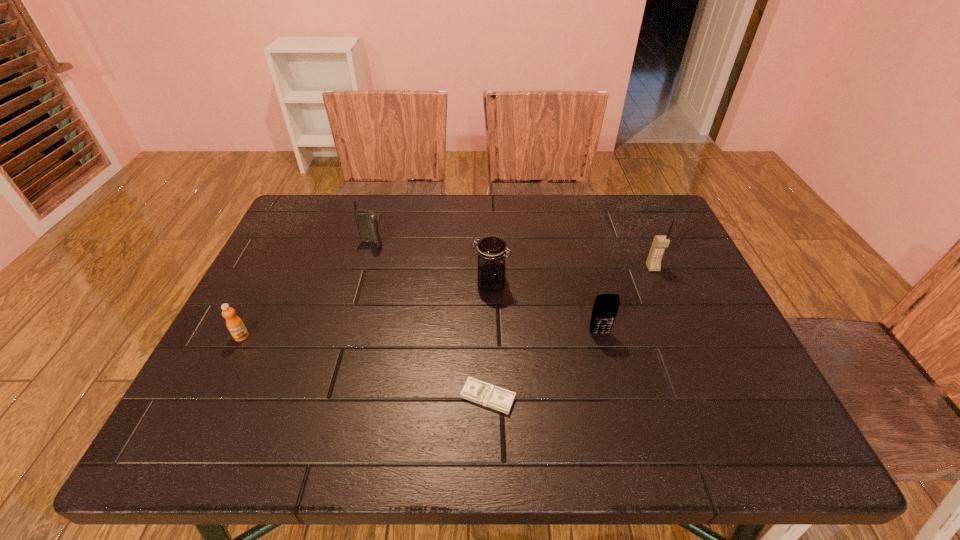
Identify which cellular telephone is the second nearest to the second shortest object. Please provide its 2D coordinates. Your answer should be formatted as a tuple, i.e. [(x, y)], where the tuple contains the x and y coordinates of a point satisfying the conditions above.

[(605, 309)]

Select which cellular telephone appears as the second closest to the farthest cellular telephone. Please provide its 2D coordinates. Your answer should be formatted as a tuple, i.e. [(x, y)], where the tuple contains the x and y coordinates of a point satisfying the conditions above.

[(660, 242)]

Image resolution: width=960 pixels, height=540 pixels. Find the location of `vacant area in the image that satisfies the following two spatial constraints: 1. on the front of the rightmost cellular telephone, where the keypad is located; 2. on the lid of the jar`. vacant area in the image that satisfies the following two spatial constraints: 1. on the front of the rightmost cellular telephone, where the keypad is located; 2. on the lid of the jar is located at coordinates (660, 283).

At what (x,y) coordinates should I click in order to perform the action: click on vacant space that satisfies the following two spatial constraints: 1. on the lid of the fourth nearest object; 2. on the front label of the orange juice. Please return your answer as a coordinate pair (x, y). Looking at the image, I should click on (492, 336).